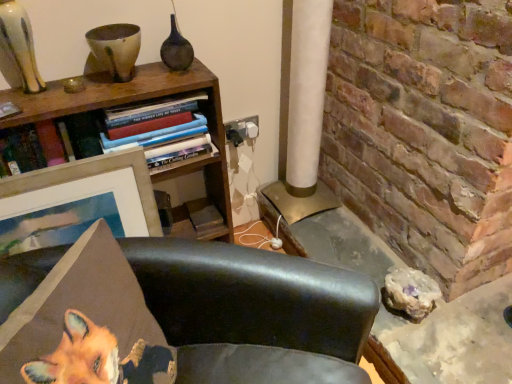
Question: Should I look upward or downward to see matte dark brown vase at upper center?

Choices:
 (A) up
 (B) down

Answer: (A)

Question: From the image's perspective, would you say metallic gold table at lower right is positioned over leather chair at lower center?

Choices:
 (A) no
 (B) yes

Answer: (B)

Question: Is metallic gold table at lower right shorter than leather chair at lower center?

Choices:
 (A) no
 (B) yes

Answer: (B)

Question: Is metallic gold table at lower right facing away from leather chair at lower center?

Choices:
 (A) yes
 (B) no

Answer: (B)

Question: Considering the relative positions of metallic gold table at lower right and leather chair at lower center in the image provided, is metallic gold table at lower right to the right of leather chair at lower center from the viewer's perspective?

Choices:
 (A) no
 (B) yes

Answer: (B)

Question: Does metallic gold table at lower right contain leather chair at lower center?

Choices:
 (A) yes
 (B) no

Answer: (B)

Question: Is metallic gold table at lower right completely or partially outside of leather chair at lower center?

Choices:
 (A) no
 (B) yes

Answer: (B)

Question: Can you confirm if leather chair at lower center is smaller than hardcover books at upper left?

Choices:
 (A) no
 (B) yes

Answer: (A)

Question: From the image's perspective, does leather chair at lower center appear lower than hardcover books at upper left?

Choices:
 (A) yes
 (B) no

Answer: (A)

Question: Considering the relative sizes of leather chair at lower center and hardcover books at upper left in the image provided, is leather chair at lower center wider than hardcover books at upper left?

Choices:
 (A) yes
 (B) no

Answer: (A)

Question: Considering the relative sizes of leather chair at lower center and hardcover books at upper left in the image provided, is leather chair at lower center shorter than hardcover books at upper left?

Choices:
 (A) no
 (B) yes

Answer: (A)

Question: Is leather chair at lower center surrounding hardcover books at upper left?

Choices:
 (A) no
 (B) yes

Answer: (A)

Question: Can you confirm if leather chair at lower center is thinner than hardcover books at upper left?

Choices:
 (A) yes
 (B) no

Answer: (B)

Question: Is leather chair at lower center taller than wooden picture frame at upper left?

Choices:
 (A) yes
 (B) no

Answer: (A)